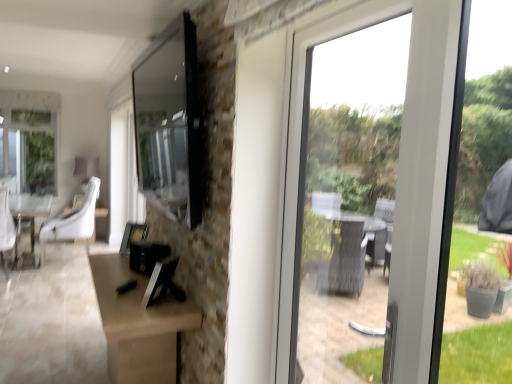
Where is `vacant area in front of white fabric chair at center`? This screenshot has height=384, width=512. vacant area in front of white fabric chair at center is located at coordinates (52, 274).